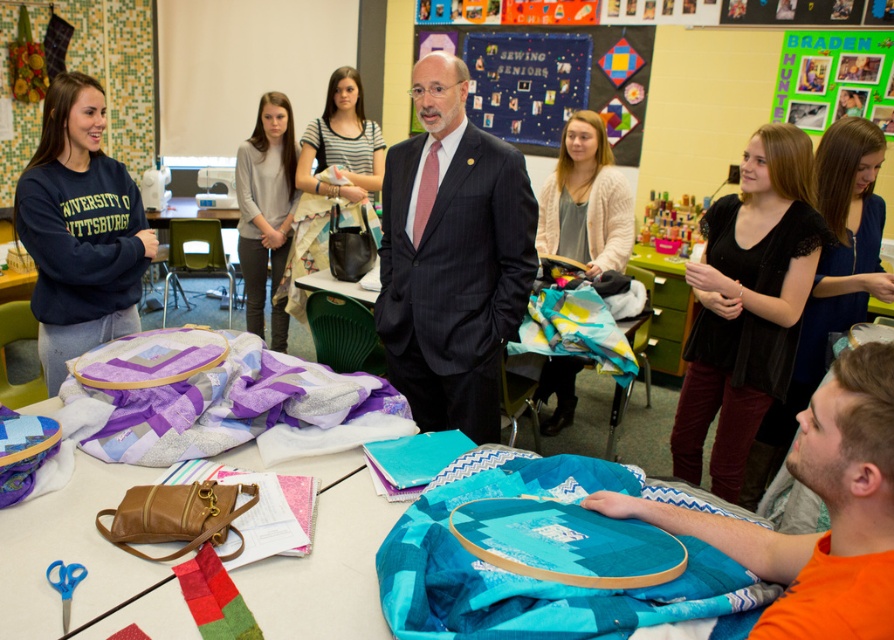
Is teal fabric at lower right to the right of purple fabric at center from the viewer's perspective?

Indeed, teal fabric at lower right is positioned on the right side of purple fabric at center.

Does teal fabric at lower right have a smaller size compared to purple fabric at center?

Correct, teal fabric at lower right occupies less space than purple fabric at center.

Where is `teal fabric at lower right`? The image size is (894, 640). teal fabric at lower right is located at coordinates (538, 579).

Image resolution: width=894 pixels, height=640 pixels. Identify the location of teal fabric at lower right. (538, 579).

Is purple fabric at center smaller than blue fabric bulletin board at center?

Correct, purple fabric at center occupies less space than blue fabric bulletin board at center.

Who is shorter, purple fabric at center or blue fabric bulletin board at center?

purple fabric at center is shorter.

Identify the location of purple fabric at center. The image size is (894, 640). (211, 394).

Can you confirm if dark pinstripe suit at center is thinner than blue fabric bulletin board at center?

Correct, dark pinstripe suit at center's width is less than blue fabric bulletin board at center's.

Find the location of a particular element. dark pinstripe suit at center is located at coordinates (452, 257).